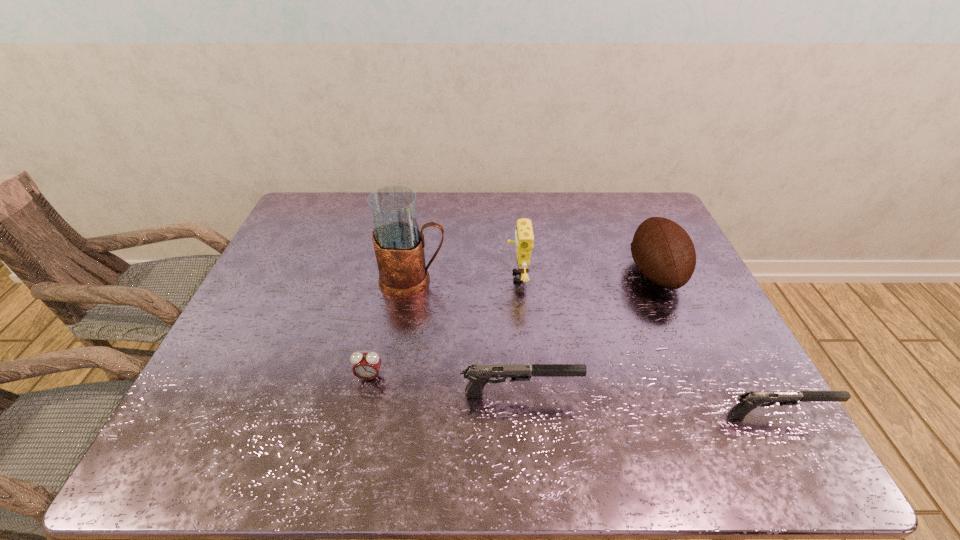
Where is `free spot at the far edge of the desktop`? Image resolution: width=960 pixels, height=540 pixels. free spot at the far edge of the desktop is located at coordinates (559, 210).

Locate an element on the screen. The height and width of the screenshot is (540, 960). vacant region at the near edge is located at coordinates (674, 394).

The image size is (960, 540). What are the coordinates of `vacant point at the left edge` in the screenshot? It's located at (251, 301).

You are a GUI agent. You are given a task and a screenshot of the screen. Output one action in this format:
    pyautogui.click(x=<x>, y=<y>)
    Task: Click on the vacant area that lies between the fourth farthest object and the taller gun
    
    Given the screenshot: What is the action you would take?
    pyautogui.click(x=444, y=385)

Identify the location of free space between the shorter gun and the taller gun. 648,404.

At what (x,y) coordinates should I click in order to perform the action: click on vacant point located between the pitcher and the second nearest object. Please return your answer as a coordinate pair (x, y). Looking at the image, I should click on (467, 337).

Where is `vacant space that's between the pitcher and the farther gun`? vacant space that's between the pitcher and the farther gun is located at coordinates (467, 337).

I want to click on empty space that is in between the football and the shorter gun, so click(x=716, y=344).

You are a GUI agent. You are given a task and a screenshot of the screen. Output one action in this format:
    pyautogui.click(x=<x>, y=<y>)
    Task: Click on the free spot between the third nearest object and the sponge
    
    Given the screenshot: What is the action you would take?
    pyautogui.click(x=444, y=327)

Where is `free spot between the alarm clock and the tallest object`? The width and height of the screenshot is (960, 540). free spot between the alarm clock and the tallest object is located at coordinates (391, 328).